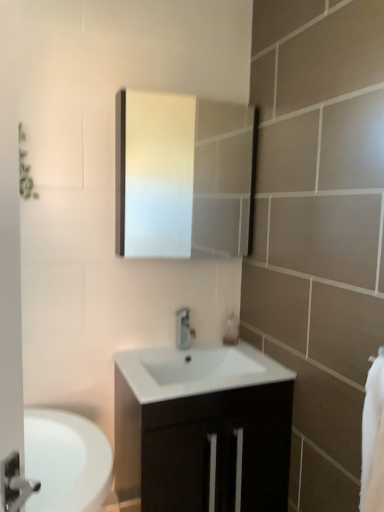
Where is `vacant region to the left of translucent plastic soap dispenser at center`? The image size is (384, 512). vacant region to the left of translucent plastic soap dispenser at center is located at coordinates (198, 347).